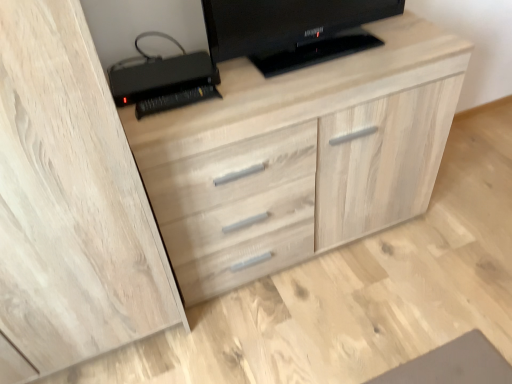
Locate an element on the screen. This screenshot has width=512, height=384. free spot in front of black plastic printer at upper left is located at coordinates (174, 117).